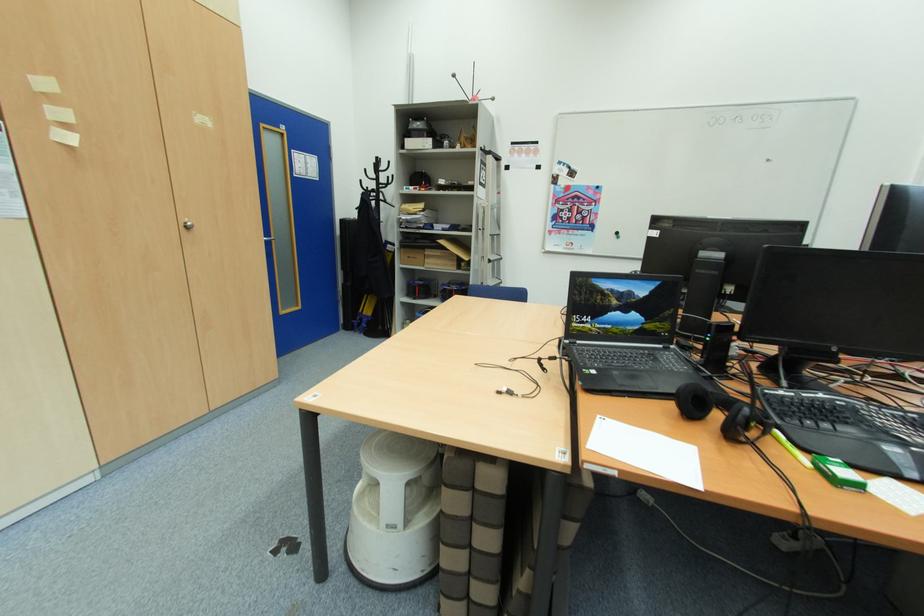
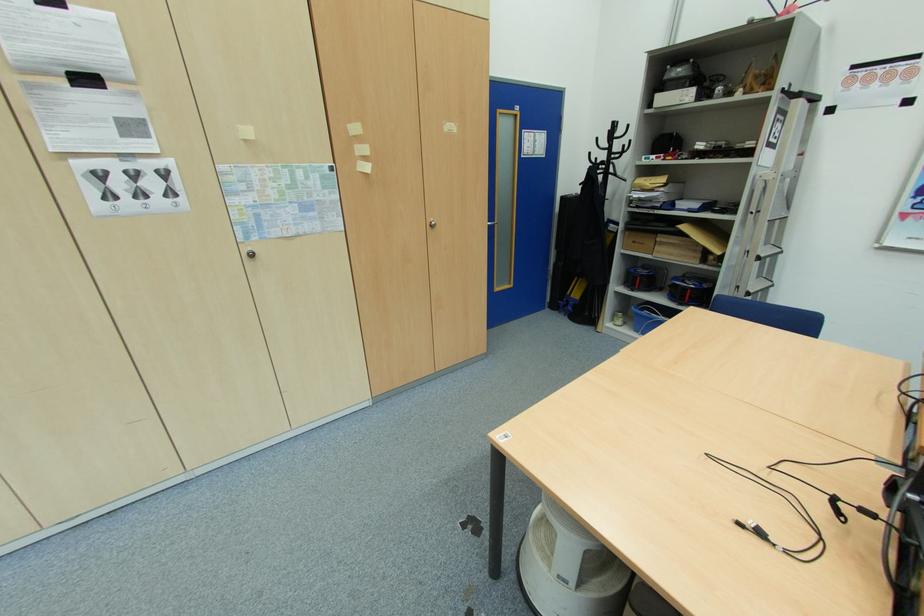
Where in the second image is the point corresponding to point 467,288 from the first image?

(709, 286)